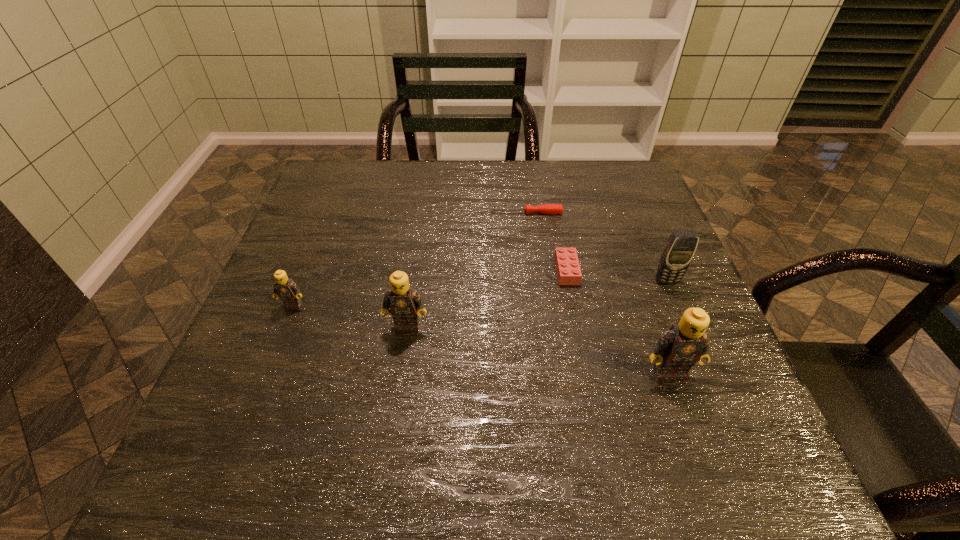
Find the location of a particular element. This screenshot has height=540, width=960. the second farthest Lego is located at coordinates (286, 289).

At what (x,y) coordinates should I click in order to perform the action: click on the second shortest Lego. Please return your answer as a coordinate pair (x, y). The height and width of the screenshot is (540, 960). Looking at the image, I should click on (286, 289).

The width and height of the screenshot is (960, 540). Identify the location of the second Lego from left to right. (405, 303).

The height and width of the screenshot is (540, 960). What are the coordinates of `the fifth farthest object` in the screenshot? It's located at (405, 303).

Identify the location of the rightmost Lego. This screenshot has height=540, width=960. (678, 349).

What are the coordinates of `the nearest Lego` in the screenshot? It's located at (678, 349).

The image size is (960, 540). What are the coordinates of `screwdriver` in the screenshot? It's located at (549, 209).

The height and width of the screenshot is (540, 960). Identify the location of the farthest object. click(x=549, y=209).

Identify the location of cellular telephone. The height and width of the screenshot is (540, 960). (681, 246).

Locate an element on the screen. the fifth tallest object is located at coordinates (568, 269).